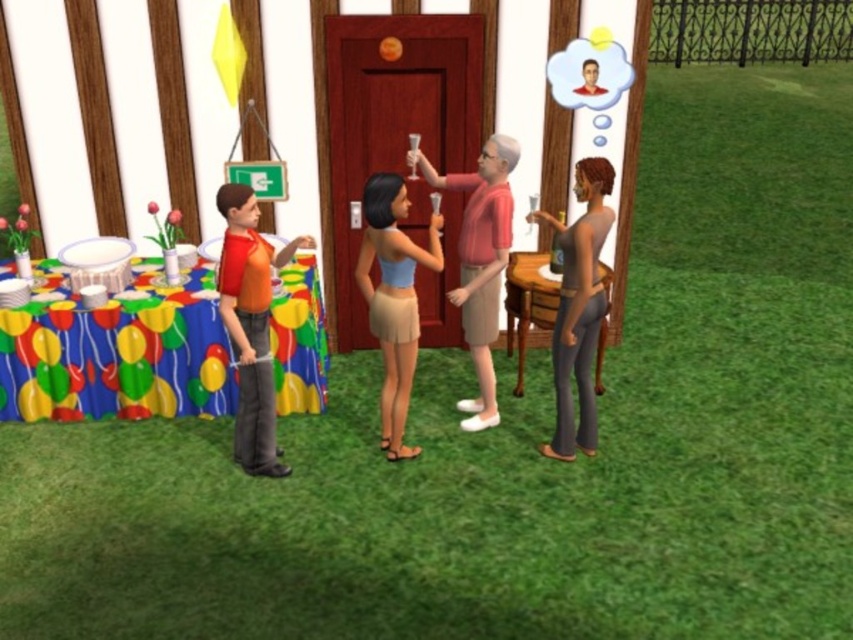
Is smooth gray pants at right wider than matte pink shirt at center?

No.

The width and height of the screenshot is (853, 640). In order to click on smooth gray pants at right in this screenshot , I will do `click(578, 308)`.

Based on the photo, is balloon-patterned tablecloth at lower left wider than orange shirt at left?

Yes.

Who is more distant from viewer, (283, 394) or (260, 244)?

Positioned behind is point (283, 394).

Identify the location of balloon-patterned tablecloth at lower left. (117, 349).

How much distance is there between balloon-patterned tablecloth at lower left and smooth gray pants at right?

A distance of 9.51 feet exists between balloon-patterned tablecloth at lower left and smooth gray pants at right.

The width and height of the screenshot is (853, 640). I want to click on balloon-patterned tablecloth at lower left, so click(117, 349).

Where is `balloon-patterned tablecloth at lower left`? The height and width of the screenshot is (640, 853). balloon-patterned tablecloth at lower left is located at coordinates (117, 349).